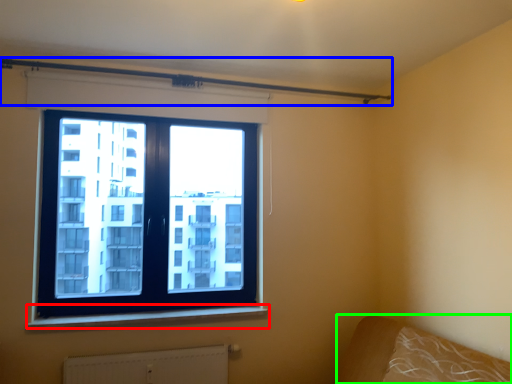
Question: Which is farther away from window sill (highlighted by a red box)? beam (highlighted by a blue box) or bed frame (highlighted by a green box)?

Choices:
 (A) beam
 (B) bed frame

Answer: (A)